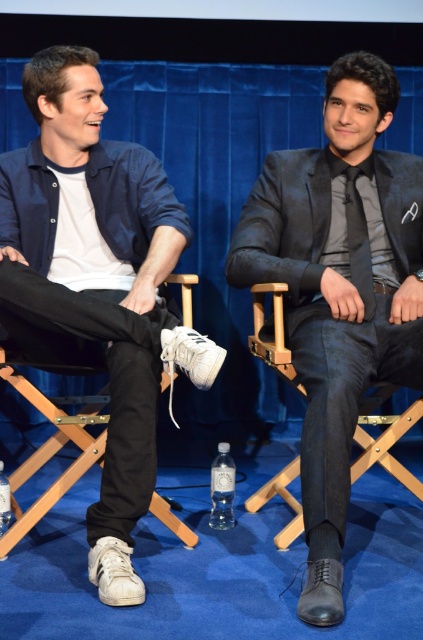
You are standing at the point labeled as point (47, 132) in the image. You want to throw a small ball to the viewer who is 2.26 meters away from you. Is the distance within a typical throwing range for an average adult?

The distance between point (47, 132) and the viewer is 2.26 meters, which is well within the typical throwing range for an average adult. The ball can be easily thrown to the viewer.

In the scene shown: You are standing in front of the two people seated on the director chairs. The point at coordinate (x=96, y=284) is pointing to an object in the scene. Which object is it pointing to?

The point at coordinate (x=96, y=284) is pointing to the white leather sneakers at lower left.